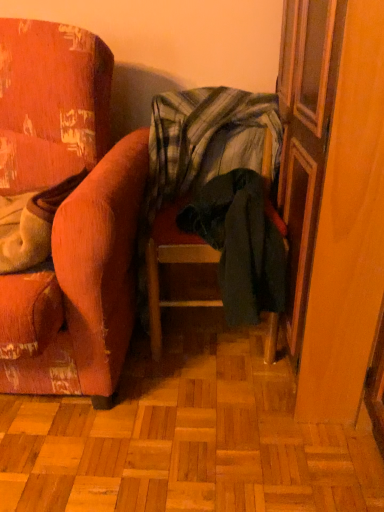
Question: From a real-world perspective, relative to wooden screen door at right, is plaid fabric blanket at center vertically above or below?

Choices:
 (A) below
 (B) above

Answer: (B)

Question: Is plaid fabric blanket at center bigger or smaller than wooden screen door at right?

Choices:
 (A) small
 (B) big

Answer: (A)

Question: Which object is the farthest from the plaid fabric blanket at center?

Choices:
 (A) dark green fabric chair at center, the second chair in the left-to-right sequence
 (B) velvet orange armchair at left, acting as the 1th chair starting from the left
 (C) wooden screen door at right

Answer: (C)

Question: Which is nearer to the wooden screen door at right?

Choices:
 (A) dark green fabric chair at center, the second chair in the left-to-right sequence
 (B) plaid fabric blanket at center
 (C) velvet orange armchair at left, acting as the 1th chair starting from the left

Answer: (A)